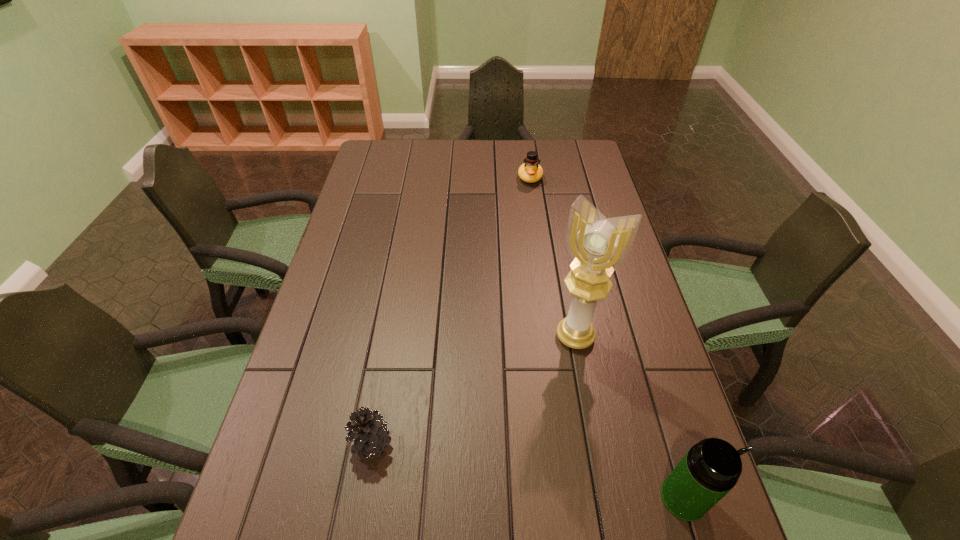
The height and width of the screenshot is (540, 960). In the image, there is a desktop. Identify the location of free space at the near edge. (512, 511).

At what (x,y) coordinates should I click in order to perform the action: click on free space at the left edge of the desktop. Please return your answer as a coordinate pair (x, y). Looking at the image, I should click on (363, 258).

Locate an element on the screen. Image resolution: width=960 pixels, height=540 pixels. free space at the right edge of the desktop is located at coordinates (598, 176).

The height and width of the screenshot is (540, 960). Identify the location of free space at the far left corner of the desktop. (404, 148).

This screenshot has height=540, width=960. In the image, there is a desktop. Find the location of `vacant space at the far right corner`. vacant space at the far right corner is located at coordinates (573, 152).

What are the coordinates of `free spot between the rightmost object and the leftmost object` in the screenshot? It's located at (527, 470).

The image size is (960, 540). I want to click on free space between the farthest object and the award, so click(553, 257).

Locate an element on the screen. This screenshot has height=540, width=960. vacant space that's between the nearest object and the pinecone is located at coordinates (527, 470).

You are a GUI agent. You are given a task and a screenshot of the screen. Output one action in this format:
    pyautogui.click(x=<x>, y=<y>)
    Task: Click on the empty space between the farthest object and the thermos bottle
    
    Given the screenshot: What is the action you would take?
    pyautogui.click(x=607, y=338)

Locate an element on the screen. unoccupied position between the award and the farthest object is located at coordinates (553, 257).